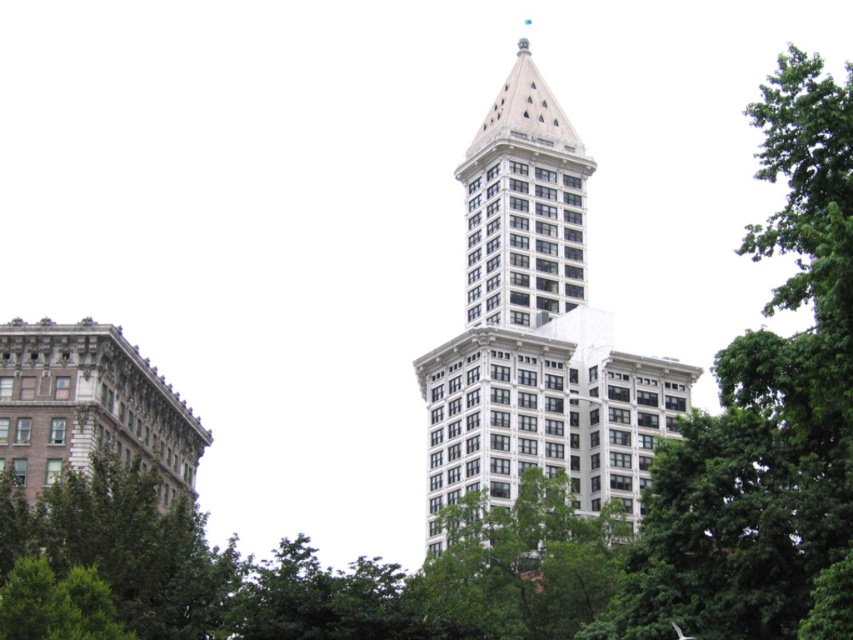
Question: Does green leafy tree at upper right have a smaller size compared to white stone building at center?

Choices:
 (A) no
 (B) yes

Answer: (A)

Question: Among these points, which one is farthest from the camera?

Choices:
 (A) click(x=793, y=401)
 (B) click(x=582, y=461)

Answer: (B)

Question: Does green leafy tree at upper right have a lesser width compared to white stone building at center?

Choices:
 (A) yes
 (B) no

Answer: (B)

Question: From the image, what is the correct spatial relationship of green leafy tree at upper right in relation to white stone building at center?

Choices:
 (A) below
 (B) above

Answer: (B)